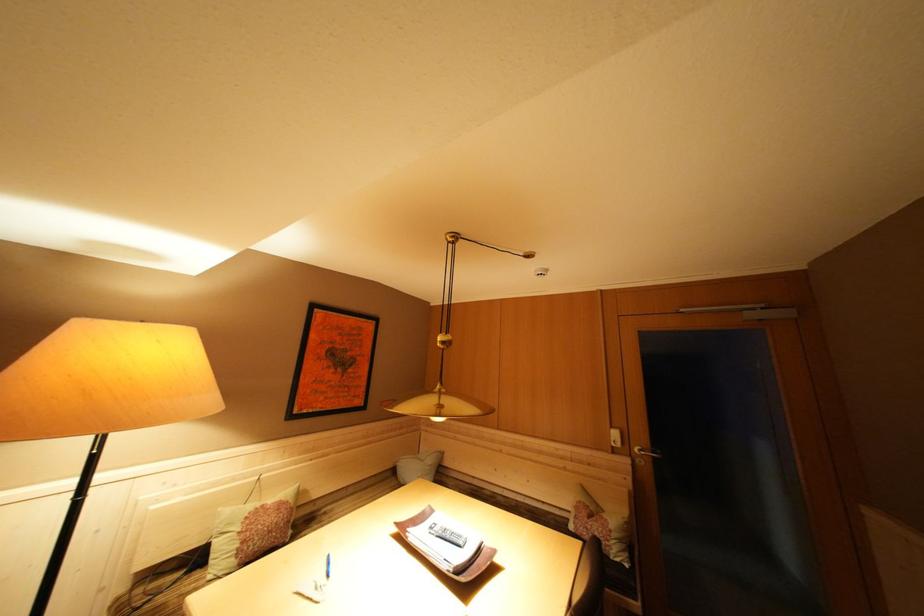
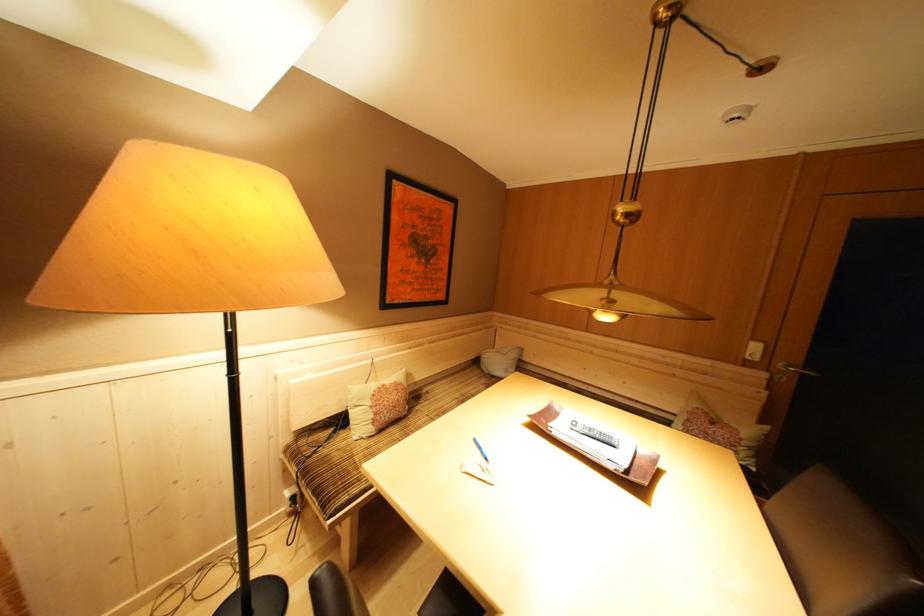
What movement of the cameraman would produce the second image?

The cameraman moved toward left, forward.